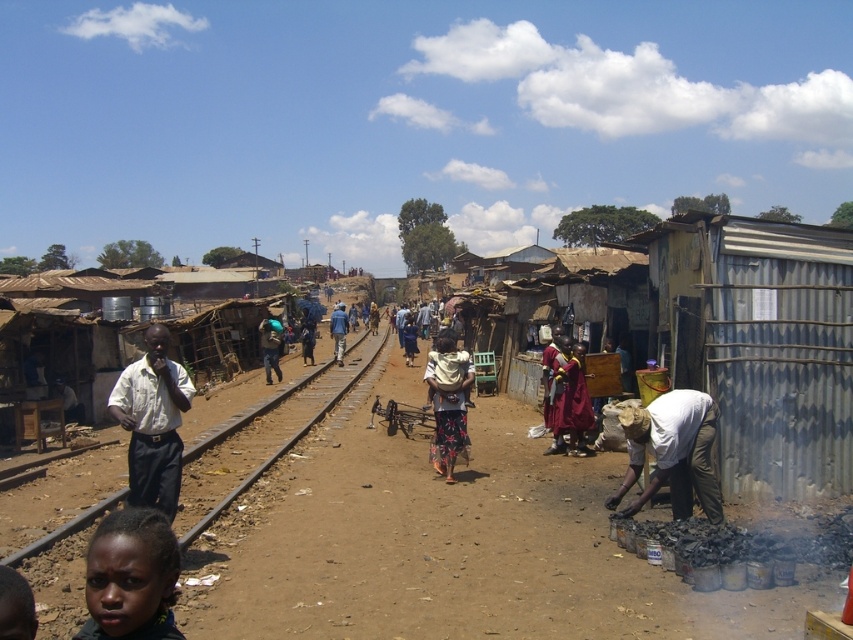
You are a photographer standing at the edge of the railway tracks. You notice a dark skin face at lower left and a white shirt at center in your viewfinder. Which object is positioned more to the right from your perspective?

The dark skin face at lower left is positioned more to the right compared to the white shirt at center according to the description.

You are a photographer standing at the railway tracks in the urban area. You notice a dark skin face at lower left and a floral fabric dress at center in your viewfinder. Which object is closer to the camera?

The dark skin face at lower left is closer to the camera because it appears shorter than the floral fabric dress at center, which suggests it is positioned in front.

You are a delivery person standing at the blue fabric at center. You need to deliver a package to the white matte shirt at lower right. The delivery robot you are using has a maximum range of 50 feet. Can the robot reach the destination without needing a recharge?

The distance between the white matte shirt at lower right and the blue fabric at center is 51.59 feet, which exceeds the robot s 50 feet range. Therefore, the robot cannot reach the destination without recharging.